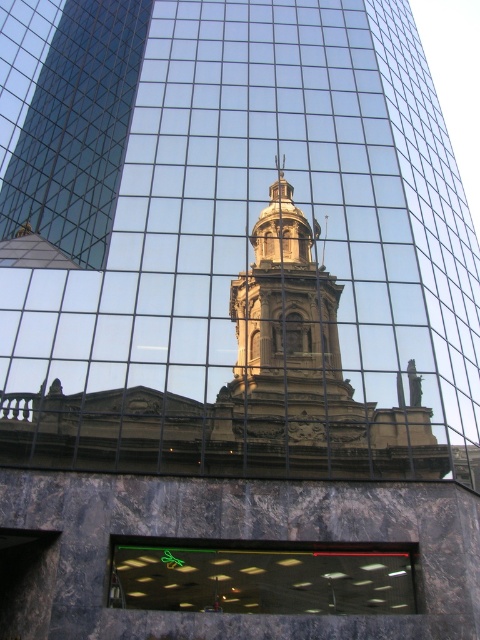
You are an architect analyzing the modern glass skyscraper. You observe the translucent glass window at center and the golden stone bell tower at center. Which object appears closer to the left side of the skyscraper?

The translucent glass window at center is positioned to the left of the golden stone bell tower at center, so it appears closer to the left side of the skyscraper.

You are an architect analyzing the building facade. You observe the translucent glass window at center and the golden stone bell tower at center. Which object is closer to the viewer?

The translucent glass window at center is closer to the viewer than the golden stone bell tower at center because it is positioned in front of it.